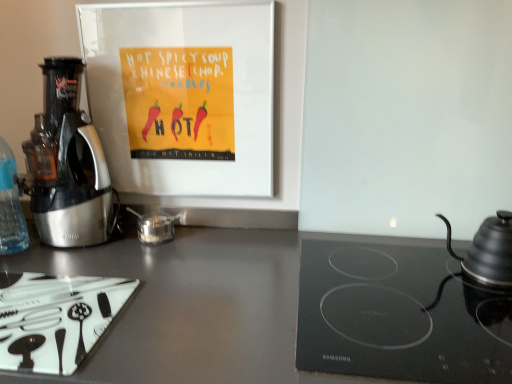
The height and width of the screenshot is (384, 512). Find the location of `vacant space in front of metallic silver coffee maker at left`. vacant space in front of metallic silver coffee maker at left is located at coordinates (61, 257).